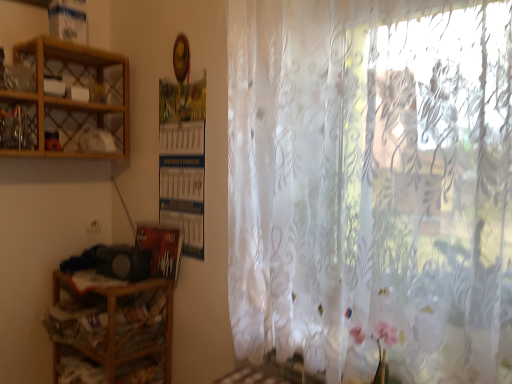
You are a GUI agent. You are given a task and a screenshot of the screen. Output one action in this format:
    pyautogui.click(x=<x>, y=<y>)
    Task: Click on the woodenobject at upper left, the first shelf viewed from the top
    This screenshot has width=512, height=384.
    Given the screenshot: What is the action you would take?
    pyautogui.click(x=71, y=100)

Locate an element on the screen. Image resolution: width=512 pixels, height=384 pixels. wooden cabinet at upper left is located at coordinates pos(17,128).

Describe the element at coordinates (111, 330) in the screenshot. I see `wooden at left, which is the first shelf from bottom to top` at that location.

Identify the location of woodenobject at upper left, the first shelf viewed from the top. The height and width of the screenshot is (384, 512). (71, 100).

Measure the distance between wooden cabinet at upper left and wooden at left, which is the first shelf from bottom to top.

wooden cabinet at upper left is 34.43 inches away from wooden at left, which is the first shelf from bottom to top.

From the image's perspective, relative to wooden at left, the 2th shelf from the top, is wooden cabinet at upper left above or below?

From the image's perspective, wooden cabinet at upper left appears above wooden at left, the 2th shelf from the top.

Which of these two, wooden cabinet at upper left or wooden at left, the 2th shelf from the top, stands taller?

wooden at left, the 2th shelf from the top, is taller.

What's the angular difference between wooden cabinet at upper left and wooden at left, which is the first shelf from bottom to top,'s facing directions?

88.7 degrees separate the facing orientations of wooden cabinet at upper left and wooden at left, which is the first shelf from bottom to top.

Which object is further away from the camera, woodenobject at upper left, the first shelf viewed from the top, or translucent floral-patterned curtain at right?

woodenobject at upper left, the first shelf viewed from the top, is more distant.

From a real-world perspective, is woodenobject at upper left, the 2th shelf in the bottom-to-top sequence, positioned under translucent floral-patterned curtain at right based on gravity?

Incorrect, from a real-world perspective, woodenobject at upper left, the 2th shelf in the bottom-to-top sequence, is higher than translucent floral-patterned curtain at right.

Is translucent floral-patterned curtain at right completely or partially inside woodenobject at upper left, the first shelf viewed from the top?

Actually, translucent floral-patterned curtain at right is outside woodenobject at upper left, the first shelf viewed from the top.

Is wooden at left, the 2th shelf from the top, outside of woodenobject at upper left, the 2th shelf in the bottom-to-top sequence?

Absolutely, wooden at left, the 2th shelf from the top, is external to woodenobject at upper left, the 2th shelf in the bottom-to-top sequence.

Is the depth of wooden at left, the 2th shelf from the top, greater than that of woodenobject at upper left, the 2th shelf in the bottom-to-top sequence?

Yes, wooden at left, the 2th shelf from the top, is behind woodenobject at upper left, the 2th shelf in the bottom-to-top sequence.

Is wooden at left, the 2th shelf from the top, oriented towards woodenobject at upper left, the 2th shelf in the bottom-to-top sequence?

A: No, wooden at left, the 2th shelf from the top, is not oriented towards woodenobject at upper left, the 2th shelf in the bottom-to-top sequence.

Could you measure the distance between wooden at left, which is the first shelf from bottom to top, and woodenobject at upper left, the first shelf viewed from the top?

They are 31.49 inches apart.

In the image, is wooden at left, which is the first shelf from bottom to top, positioned in front of or behind wooden cabinet at upper left?

Visually, wooden at left, which is the first shelf from bottom to top, is located behind wooden cabinet at upper left.

Considering the sizes of wooden at left, the 2th shelf from the top, and wooden cabinet at upper left in the image, is wooden at left, the 2th shelf from the top, bigger or smaller than wooden cabinet at upper left?

Considering their sizes, wooden at left, the 2th shelf from the top, takes up more space than wooden cabinet at upper left.

Based on the photo, could wooden cabinet at upper left be considered to be inside wooden at left, which is the first shelf from bottom to top?

No, wooden cabinet at upper left is not inside wooden at left, which is the first shelf from bottom to top.

Does point (162, 318) come behind point (7, 137)?

Yes, point (162, 318) is farther from viewer.

Locate an element on the screen. curtain lying on the right of wooden cabinet at upper left is located at coordinates (372, 187).

Is translucent floral-patterned curtain at right to the right of wooden cabinet at upper left from the viewer's perspective?

Yes.

Which is behind, point (372, 240) or point (8, 137)?

The point (8, 137) is farther.

Does translucent floral-patterned curtain at right have a greater width compared to wooden cabinet at upper left?

Yes.

Consider the image. From a real-world perspective, is translucent floral-patterned curtain at right located beneath woodenobject at upper left, the 2th shelf in the bottom-to-top sequence?

Yes, from a real-world perspective, translucent floral-patterned curtain at right is below woodenobject at upper left, the 2th shelf in the bottom-to-top sequence.

The width and height of the screenshot is (512, 384). Identify the location of shelf above the translucent floral-patterned curtain at right (from the image's perspective). (71, 100).

Is translucent floral-patterned curtain at right far from woodenobject at upper left, the 2th shelf in the bottom-to-top sequence?

Yes, translucent floral-patterned curtain at right and woodenobject at upper left, the 2th shelf in the bottom-to-top sequence, are located far from each other.

Is woodenobject at upper left, the first shelf viewed from the top, a part of translucent floral-patterned curtain at right?

No, woodenobject at upper left, the first shelf viewed from the top, is located outside of translucent floral-patterned curtain at right.

In order to click on cabinet beneath the woodenobject at upper left, the 2th shelf in the bottom-to-top sequence (from a real-world perspective) in this screenshot , I will do `click(17, 128)`.

Considering the relative sizes of wooden cabinet at upper left and woodenobject at upper left, the first shelf viewed from the top, in the image provided, is wooden cabinet at upper left bigger than woodenobject at upper left, the first shelf viewed from the top,?

No, wooden cabinet at upper left is not bigger than woodenobject at upper left, the first shelf viewed from the top.

Measure the distance between wooden cabinet at upper left and woodenobject at upper left, the first shelf viewed from the top.

The distance of wooden cabinet at upper left from woodenobject at upper left, the first shelf viewed from the top, is 21.86 centimeters.

How many degrees apart are the facing directions of wooden cabinet at upper left and woodenobject at upper left, the first shelf viewed from the top?

The facing directions of wooden cabinet at upper left and woodenobject at upper left, the first shelf viewed from the top, are 0.00251 degrees apart.

Find the location of a particular element. Image resolution: width=512 pixels, height=384 pixels. cabinet above the wooden at left, which is the first shelf from bottom to top (from a real-world perspective) is located at coordinates (17, 128).

Which shelf is the 2nd one when counting from the left side of the translucent floral-patterned curtain at right? Please provide its 2D coordinates.

[(71, 100)]

Considering their positions, is translucent floral-patterned curtain at right positioned further to wooden cabinet at upper left than woodenobject at upper left, the 2th shelf in the bottom-to-top sequence?

translucent floral-patterned curtain at right.

Which object lies nearer to the anchor point woodenobject at upper left, the 2th shelf in the bottom-to-top sequence, wooden cabinet at upper left or translucent floral-patterned curtain at right?

wooden cabinet at upper left lies closer to woodenobject at upper left, the 2th shelf in the bottom-to-top sequence, than the other object.

Based on their spatial positions, is wooden at left, which is the first shelf from bottom to top, or translucent floral-patterned curtain at right further from wooden cabinet at upper left?

translucent floral-patterned curtain at right lies further to wooden cabinet at upper left than the other object.

From the image, which object appears to be farther from wooden cabinet at upper left, woodenobject at upper left, the first shelf viewed from the top, or translucent floral-patterned curtain at right?

translucent floral-patterned curtain at right.

Considering their positions, is woodenobject at upper left, the 2th shelf in the bottom-to-top sequence, positioned closer to wooden at left, which is the first shelf from bottom to top, than wooden cabinet at upper left?

Based on the image, woodenobject at upper left, the 2th shelf in the bottom-to-top sequence, appears to be nearer to wooden at left, which is the first shelf from bottom to top.

In the scene shown: Which object lies nearer to the anchor point wooden cabinet at upper left, woodenobject at upper left, the 2th shelf in the bottom-to-top sequence, or wooden at left, which is the first shelf from bottom to top?

The object closer to wooden cabinet at upper left is woodenobject at upper left, the 2th shelf in the bottom-to-top sequence.

Considering their positions, is wooden at left, the 2th shelf from the top, positioned closer to woodenobject at upper left, the first shelf viewed from the top, than wooden cabinet at upper left?

The object closer to woodenobject at upper left, the first shelf viewed from the top, is wooden cabinet at upper left.

Estimate the real-world distances between objects in this image. Which object is closer to translucent floral-patterned curtain at right, wooden at left, which is the first shelf from bottom to top, or wooden cabinet at upper left?

wooden at left, which is the first shelf from bottom to top, is closer to translucent floral-patterned curtain at right.

I want to click on cabinet that lies between woodenobject at upper left, the first shelf viewed from the top, and wooden at left, which is the first shelf from bottom to top, from top to bottom, so click(17, 128).

Where is `shelf between woodenobject at upper left, the 2th shelf in the bottom-to-top sequence, and translucent floral-patterned curtain at right, in the horizontal direction`? This screenshot has width=512, height=384. shelf between woodenobject at upper left, the 2th shelf in the bottom-to-top sequence, and translucent floral-patterned curtain at right, in the horizontal direction is located at coordinates (111, 330).